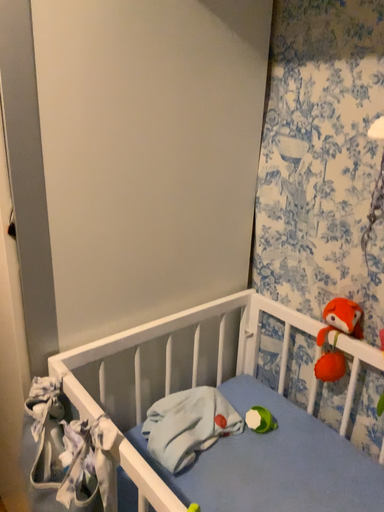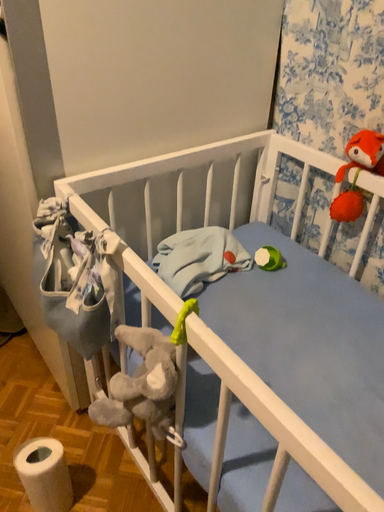
Question: How did the camera likely rotate when shooting the video?

Choices:
 (A) rotated downward
 (B) rotated upward

Answer: (A)